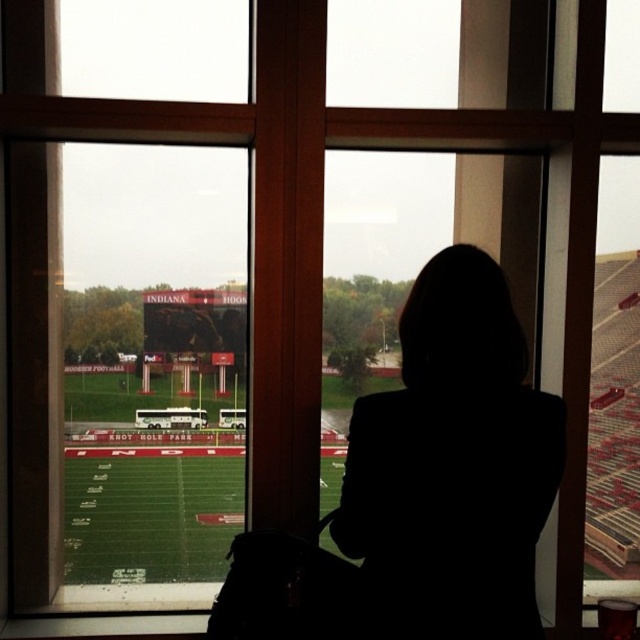
You are standing inside a building and looking through the green glass window at center. There is a silhouette jacket at center blocking part of your view. Can you tell if the jacket is wider than the window?

The green glass window at center is wider than the silhouette jacket at center, so the jacket is not wider than the window.

You are standing in a room with a green glass window at center. You want to place a 2.5 feet wide painting on the window. Can the painting fit on the window?

The green glass window at center has a width of 8.36 feet. Since the painting is 2.5 feet wide, it will fit as the window is wider than the painting.

You are standing inside a building and looking through the green glass window at center. There is a silhouette jacket at center in front of you. Can you see the football field clearly through the window?

The green glass window at center is positioned over silhouette jacket at center, so the silhouette jacket at center is blocking your view of the football field through the window.